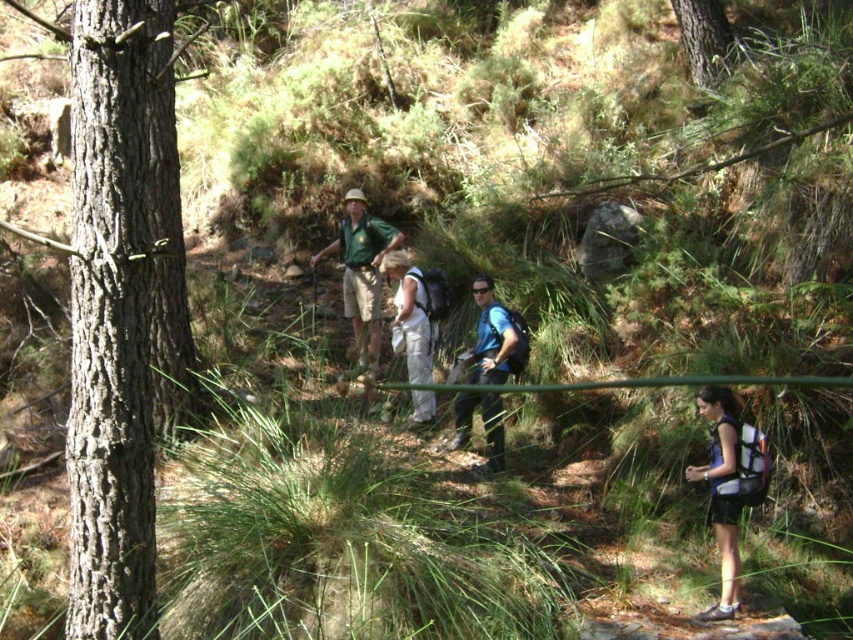
Looking at this image, can you confirm if blue fabric backpack at center is positioned below matte khaki shorts at center?

Yes, blue fabric backpack at center is below matte khaki shorts at center.

Does point (503, 344) come behind point (312, 266)?

That is False.

At what (x,y) coordinates should I click in order to perform the action: click on blue fabric backpack at center. Please return your answer as a coordinate pair (x, y). Looking at the image, I should click on (494, 337).

Can you confirm if gray rough bark tree at left is positioned to the right of white fabric pants at center?

No, gray rough bark tree at left is not to the right of white fabric pants at center.

Which is below, gray rough bark tree at left or white fabric pants at center?

white fabric pants at center is lower down.

Between point (140, 428) and point (432, 355), which one is positioned behind?

Positioned behind is point (432, 355).

I want to click on gray rough bark tree at left, so click(122, 308).

Which of these two, gray rough bark tree at left or matte khaki shorts at center, stands shorter?

Standing shorter between the two is matte khaki shorts at center.

Does gray rough bark tree at left appear on the left side of matte khaki shorts at center?

Indeed, gray rough bark tree at left is positioned on the left side of matte khaki shorts at center.

Between point (149, 211) and point (389, 250), which one is positioned in front?

Point (149, 211) is more forward.

This screenshot has height=640, width=853. What are the coordinates of `gray rough bark tree at left` in the screenshot? It's located at (122, 308).